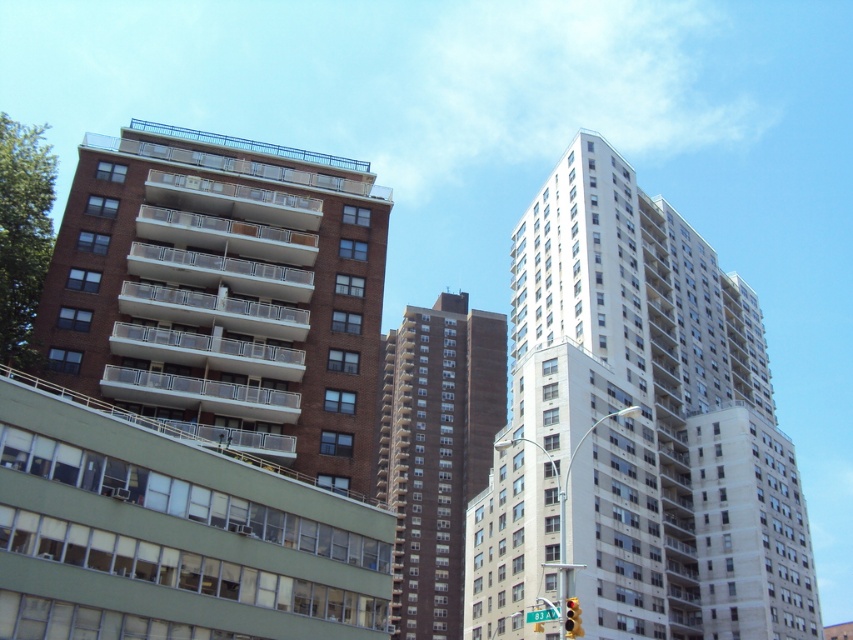
Between white smooth building at center and brown brick building at center, which one has less height?

With less height is brown brick building at center.

Is white smooth building at center below brown brick building at center?

Actually, white smooth building at center is above brown brick building at center.

Find the location of a particular element. This screenshot has width=853, height=640. white smooth building at center is located at coordinates (637, 429).

Which is more to the left, brown brick building at upper left or brown brick building at center?

brown brick building at upper left

Does brown brick building at upper left have a larger size compared to brown brick building at center?

Incorrect, brown brick building at upper left is not larger than brown brick building at center.

Where is `brown brick building at upper left`? Image resolution: width=853 pixels, height=640 pixels. brown brick building at upper left is located at coordinates (224, 292).

Is brown brick building at center thinner than green plastic street sign at center?

Incorrect, brown brick building at center's width is not less than green plastic street sign at center's.

The width and height of the screenshot is (853, 640). In order to click on brown brick building at center in this screenshot , I will do `click(436, 451)`.

Which is behind, point (492, 406) or point (546, 609)?

The point (492, 406) is more distant.

I want to click on brown brick building at center, so click(436, 451).